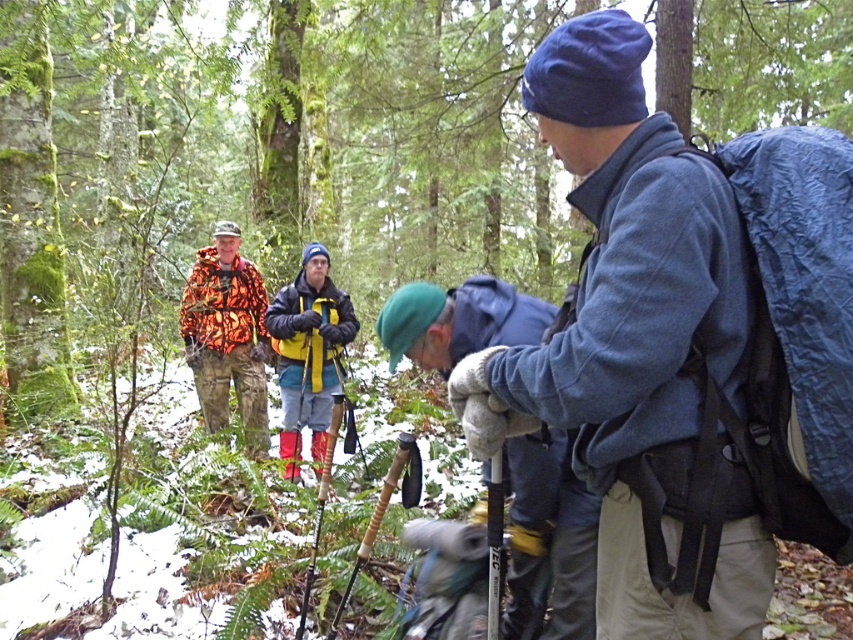
Based on the photo, is blue fleece jacket at center thinner than blue woolen hat at center?

No, blue fleece jacket at center is not thinner than blue woolen hat at center.

Is blue fleece jacket at center taller than blue woolen hat at center?

Indeed, blue fleece jacket at center has a greater height compared to blue woolen hat at center.

Locate an element on the screen. Image resolution: width=853 pixels, height=640 pixels. blue fleece jacket at center is located at coordinates 640,352.

In the scene shown: Who is positioned more to the right, camouflage fabric jacket at left or yellow fabric backpack at center?

yellow fabric backpack at center is more to the right.

Which is below, camouflage fabric jacket at left or yellow fabric backpack at center?

yellow fabric backpack at center

You are a GUI agent. You are given a task and a screenshot of the screen. Output one action in this format:
    pyautogui.click(x=<x>, y=<y>)
    Task: Click on the camouflage fabric jacket at left
    
    Given the screenshot: What is the action you would take?
    pyautogui.click(x=227, y=336)

This screenshot has width=853, height=640. I want to click on camouflage fabric jacket at left, so click(227, 336).

Does blue fleece jacket at center have a greater width compared to camouflage fabric jacket at left?

No.

Is blue fleece jacket at center bigger than camouflage fabric jacket at left?

No, blue fleece jacket at center is not bigger than camouflage fabric jacket at left.

Is point (660, 248) closer to viewer compared to point (231, 285)?

Yes, it is.

Identify the location of blue fleece jacket at center. (640, 352).